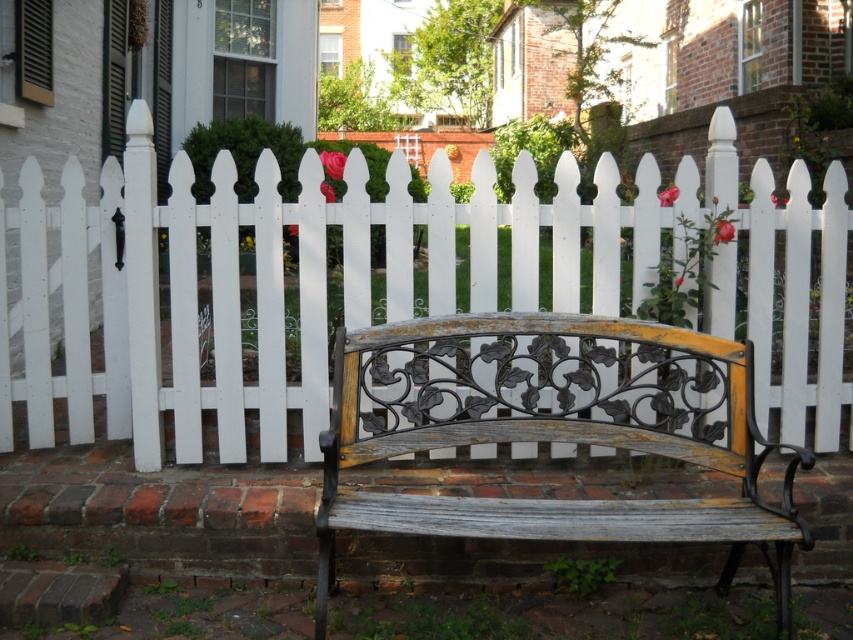
Between white picket fence at center and distressed wood bench at center, which one has more height?

With more height is white picket fence at center.

Where is `white picket fence at center`? white picket fence at center is located at coordinates (281, 284).